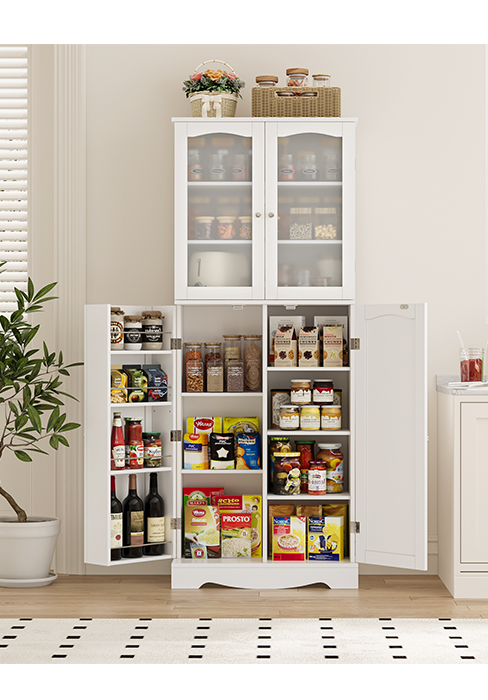
Where is `food in bottles`? The height and width of the screenshot is (700, 488). food in bottles is located at coordinates (135, 447), (112, 449), (116, 412), (121, 514), (134, 511), (146, 511).